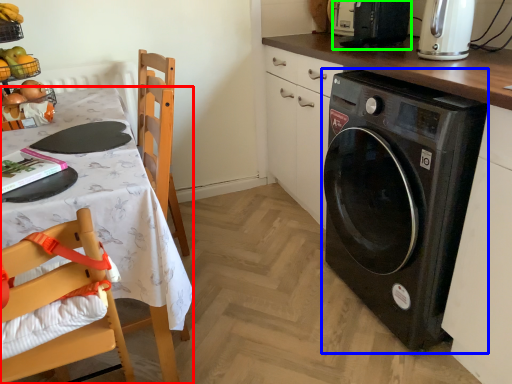
Question: Based on their relative distances, which object is nearer to desk (highlighted by a red box)? Choose from washing machine (highlighted by a blue box) and appliance (highlighted by a green box).

Choices:
 (A) washing machine
 (B) appliance

Answer: (A)